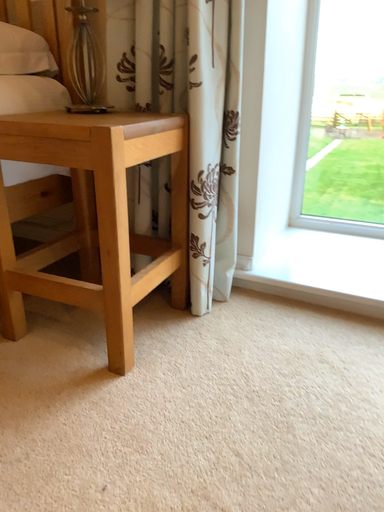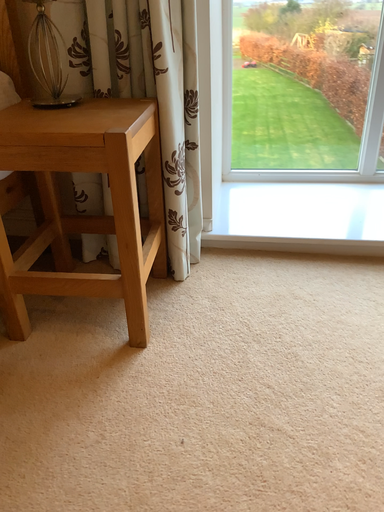
Question: Which way did the camera rotate in the video?

Choices:
 (A) rotated right
 (B) rotated left

Answer: (A)